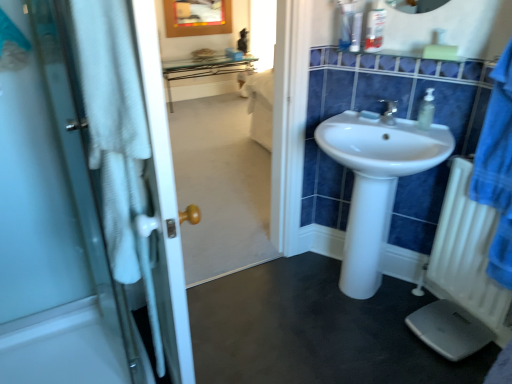
In order to click on free location above white plastic scale at lower right (from a real-world perspective) in this screenshot , I will do `click(441, 329)`.